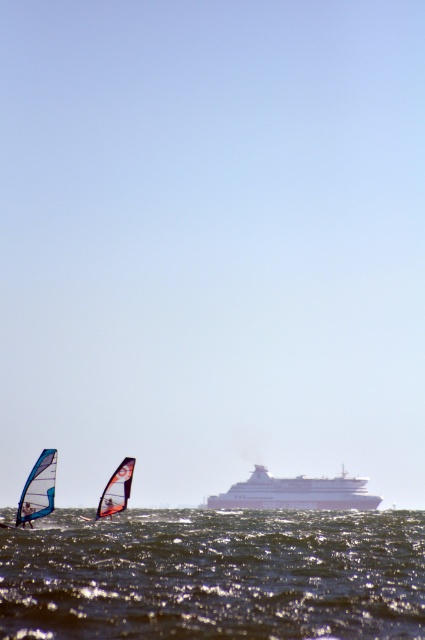
Based on the photo, you are a photographer trying to capture both the white glossy cruise ship at center and the translucent blue sail at lower left in the same frame. Which object should you focus on first to ensure both are in the frame?

The white glossy cruise ship at center has a greater height compared to the translucent blue sail at lower left. Therefore, you should focus on the white glossy cruise ship at center first to ensure both objects are within the frame.

You are standing at the point marked as point (215, 576) in the image. What do you see directly below you?

At point (215, 576) lies shiny dark water at lower center.

You are a photographer positioned at the origin point of the image coordinate system. You want to capture a photo of the white glossy cruise ship at center. What are the coordinates of the ship?

The coordinates of the white glossy cruise ship at center are at point [295,492].